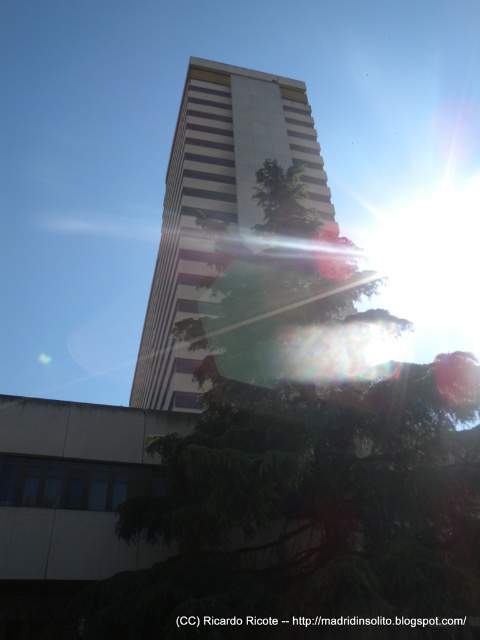
This screenshot has width=480, height=640. Describe the element at coordinates (303, 461) in the screenshot. I see `green leafy tree at center` at that location.

Between point (108, 630) and point (267, 156), which one is positioned behind?

The point (267, 156) is behind.

At what (x,y) coordinates should I click in order to perform the action: click on green leafy tree at center. Please return your answer as a coordinate pair (x, y). This screenshot has width=480, height=640. Looking at the image, I should click on (303, 461).